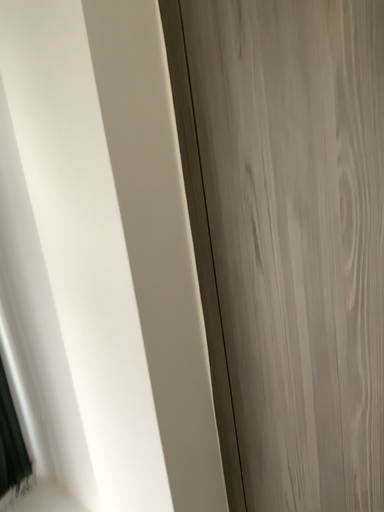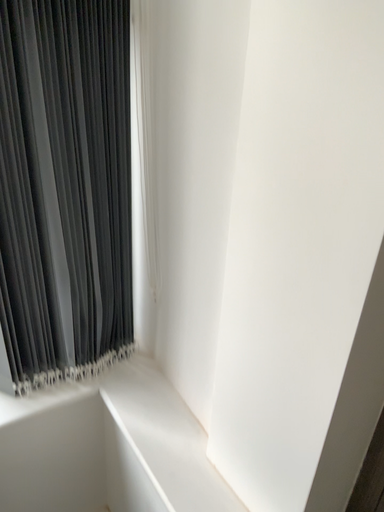
Question: Which way did the camera rotate in the video?

Choices:
 (A) rotated right
 (B) rotated left

Answer: (B)